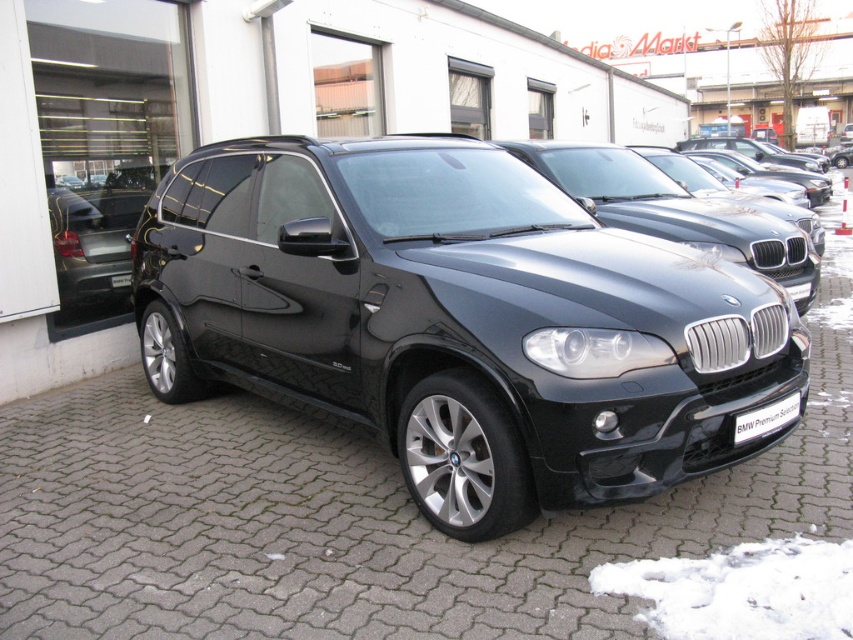
Does point (704, 451) come farther from viewer compared to point (757, 433)?

That is False.

Identify the location of matte black suv at center. (457, 321).